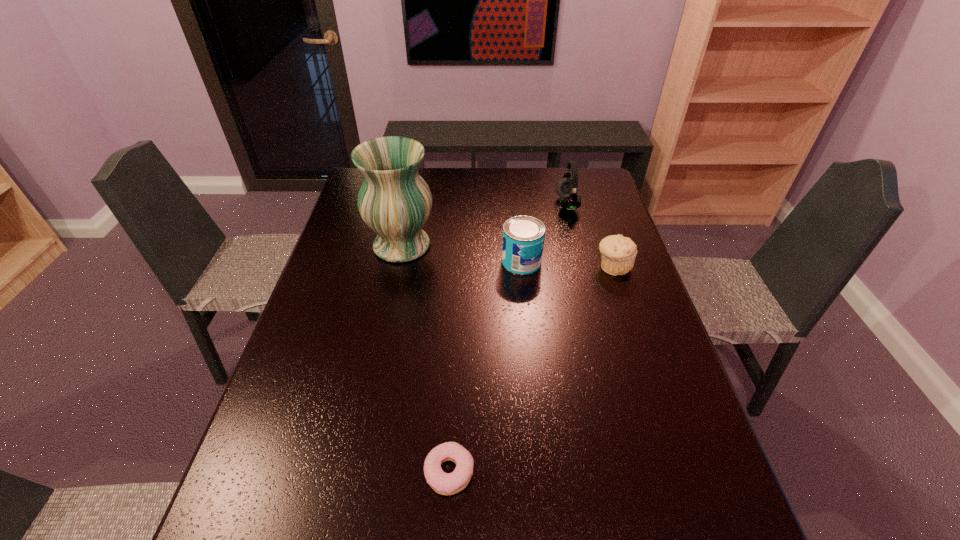
This screenshot has height=540, width=960. What are the coordinates of `free location located 0.330m on the ear cups of the farthest object` in the screenshot? It's located at (464, 204).

You are a GUI agent. You are given a task and a screenshot of the screen. Output one action in this format:
    pyautogui.click(x=<x>, y=<y>)
    Task: Click on the vacant space located 0.310m on the ear cups of the farthest object
    The image size is (960, 540).
    Given the screenshot: What is the action you would take?
    pyautogui.click(x=469, y=204)

Identify the location of free space located 0.270m on the ear cups of the farthest object. The width and height of the screenshot is (960, 540). (481, 204).

Image resolution: width=960 pixels, height=540 pixels. Identify the location of vacant region located on the back of the third object from right to left. (516, 200).

This screenshot has height=540, width=960. In order to click on vacant space located 0.370m on the back of the fourth tallest object in this screenshot , I will do `click(588, 191)`.

This screenshot has height=540, width=960. Find the location of `free space located 0.200m on the right of the doughnut`. free space located 0.200m on the right of the doughnut is located at coordinates (574, 471).

Where is `object that is at the far edge`? Image resolution: width=960 pixels, height=540 pixels. object that is at the far edge is located at coordinates (567, 188).

Locate an element on the screen. This screenshot has width=960, height=540. object that is at the left edge is located at coordinates tap(395, 202).

Locate an element on the screen. headset that is positioned at the right edge is located at coordinates (567, 188).

What are the coordinates of `muffin located in the right edge section of the desktop` in the screenshot? It's located at coord(618,253).